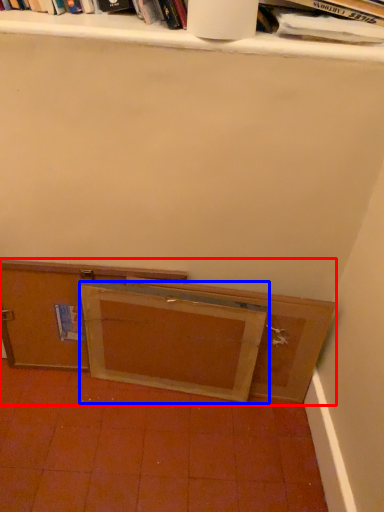
Question: Which object is closer to the camera taking this photo, cabinetry (highlighted by a red box) or wide (highlighted by a blue box)?

Choices:
 (A) cabinetry
 (B) wide

Answer: (B)